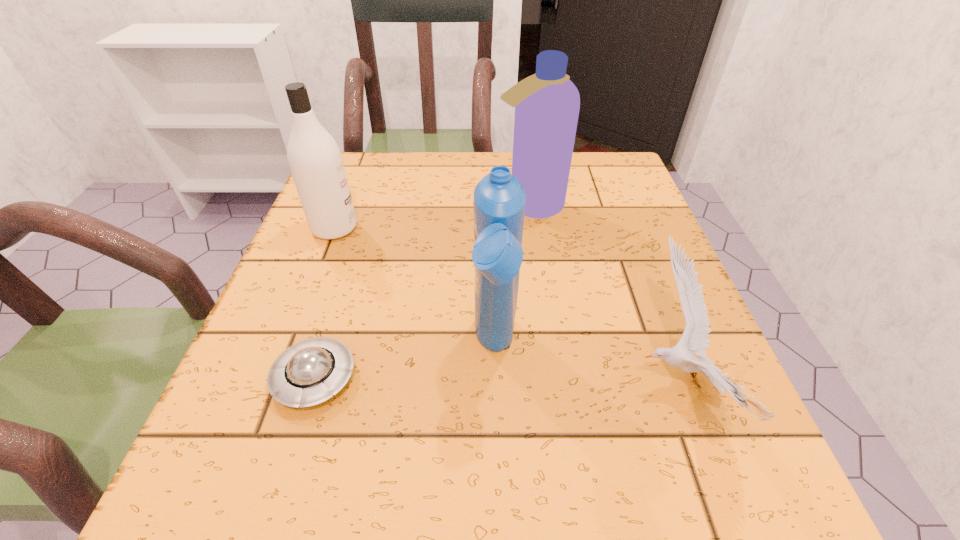
Image resolution: width=960 pixels, height=540 pixels. I want to click on free location located 0.140m on the back of the shortest object, so click(x=344, y=284).

In order to click on object present at the far edge in this screenshot , I will do `click(547, 103)`.

Locate an element on the screen. object situated at the near edge is located at coordinates (694, 340).

You are a GUI agent. You are given a task and a screenshot of the screen. Output one action in this format:
    pyautogui.click(x=<x>, y=<y>)
    Task: Click on the shampoo positioned at the left edge
    
    Given the screenshot: What is the action you would take?
    pyautogui.click(x=315, y=160)

Locate an element on the screen. The width and height of the screenshot is (960, 540). saucer located at the left edge is located at coordinates (310, 372).

Find the location of a particular element. object located in the right edge section of the desktop is located at coordinates (694, 340).

What are the coordinates of `object positioned at the near right corner` in the screenshot? It's located at [x=694, y=340].

Identify the location of vacant position at the far edge of the desktop. Image resolution: width=960 pixels, height=540 pixels. (429, 184).

Locate an element on the screen. This screenshot has height=540, width=960. vacant space at the left edge of the desktop is located at coordinates click(x=334, y=257).

In the image, there is a desktop. Where is `free region at the right edge`? free region at the right edge is located at coordinates (621, 212).